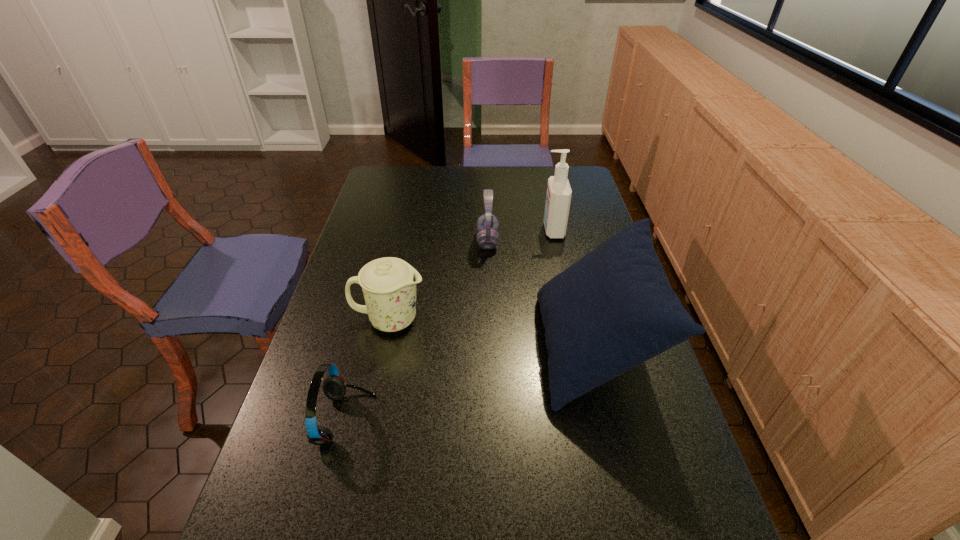
Identify the location of cleansing agent. (558, 198).

At what (x,y) coordinates should I click in order to perform the action: click on cushion. Please return your answer as a coordinate pair (x, y). Image resolution: width=960 pixels, height=540 pixels. Looking at the image, I should click on (612, 310).

Locate an element on the screen. The height and width of the screenshot is (540, 960). chinaware is located at coordinates (389, 284).

Identify the location of the farther headset. (487, 224).

Locate an element on the screen. the third object from left to right is located at coordinates (487, 224).

At what (x,y) coordinates should I click in order to perform the action: click on the shortest object. Please return your answer as a coordinate pair (x, y). Image resolution: width=960 pixels, height=540 pixels. Looking at the image, I should click on (334, 387).

Where is `the nearer headset`? This screenshot has height=540, width=960. the nearer headset is located at coordinates (334, 387).

The image size is (960, 540). I want to click on blank space located 0.180m on the front label of the cleansing agent, so click(493, 230).

At what (x,y) coordinates should I click in order to perform the action: click on blank area located on the front label of the cleansing agent. Please return your answer as a coordinate pair (x, y). This screenshot has width=960, height=540. Looking at the image, I should click on (452, 230).

The height and width of the screenshot is (540, 960). I want to click on vacant space located on the front label of the cleansing agent, so click(480, 230).